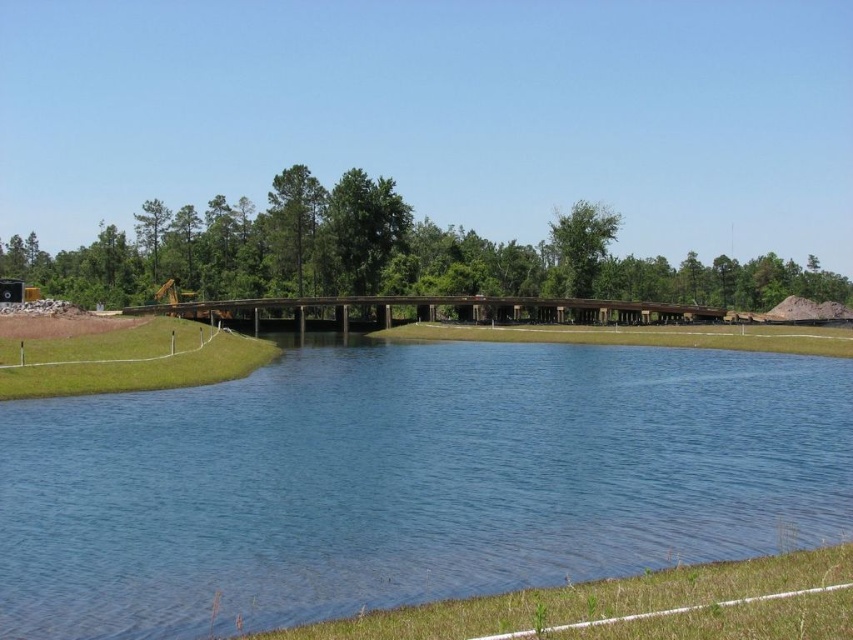
Question: Does blue water at center appear on the left side of green grass at lower right?

Choices:
 (A) yes
 (B) no

Answer: (A)

Question: Is blue water at center thinner than green grass at lower right?

Choices:
 (A) no
 (B) yes

Answer: (A)

Question: Is blue water at center wider than green grass at lower right?

Choices:
 (A) yes
 (B) no

Answer: (A)